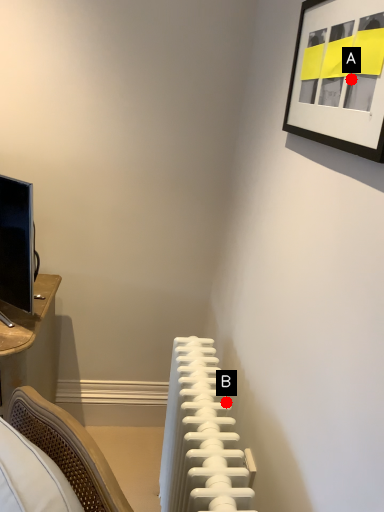
Question: Two points are circled on the image, labeled by A and B beside each circle. Among these points, which one is nearest to the camera?

Choices:
 (A) A is closer
 (B) B is closer

Answer: (A)